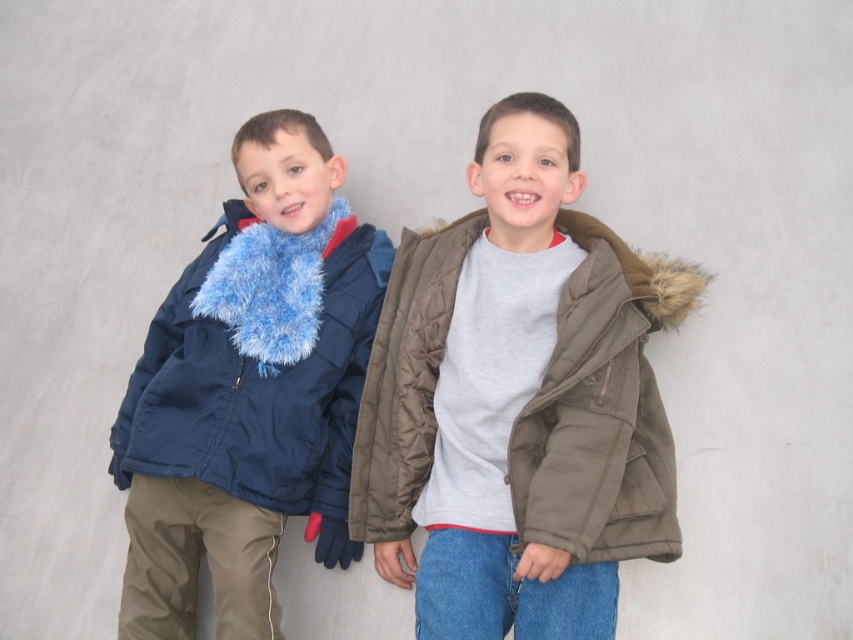
Question: Is olive green quilted jacket at center thinner than navy blue quilted jacket at left?

Choices:
 (A) no
 (B) yes

Answer: (B)

Question: Is olive green quilted jacket at center to the left of navy blue quilted jacket at left from the viewer's perspective?

Choices:
 (A) no
 (B) yes

Answer: (A)

Question: Is olive green quilted jacket at center bigger than navy blue quilted jacket at left?

Choices:
 (A) yes
 (B) no

Answer: (B)

Question: Among these points, which one is farthest from the camera?

Choices:
 (A) (143, 356)
 (B) (663, 502)

Answer: (A)